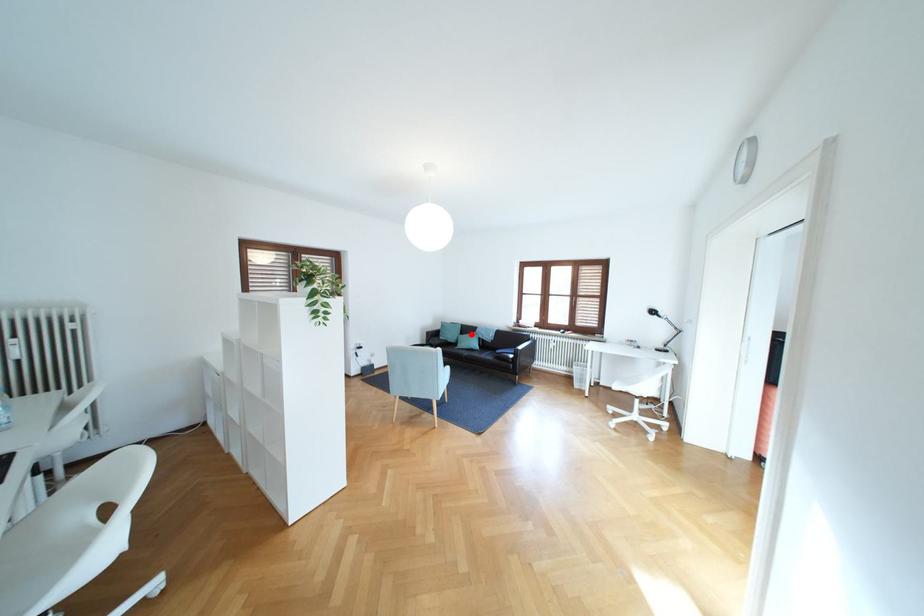
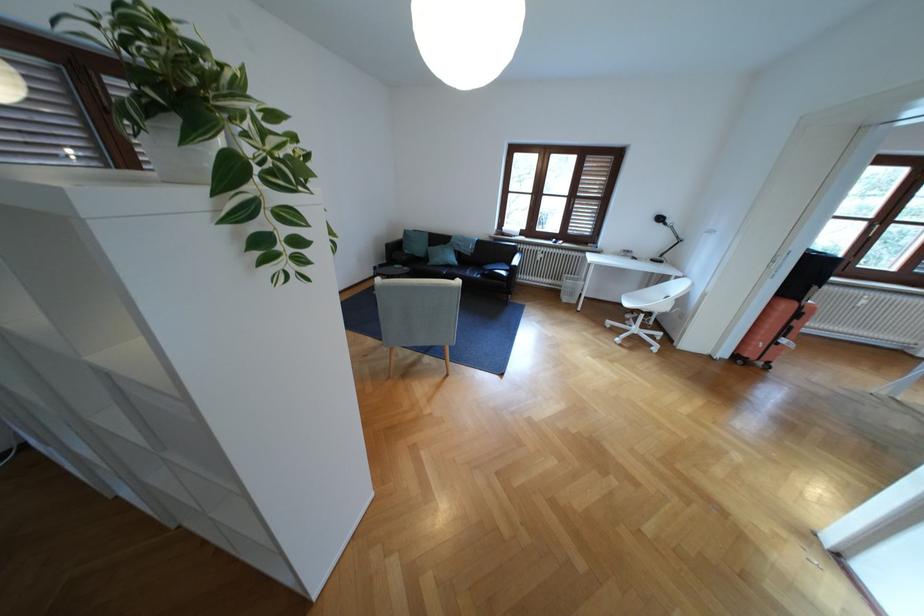
Question: I am providing you with two images of the same scene from different viewpoints. In image1, a red point is highlighted. Considering the same 3D point in image2, which of the following is correct?

Choices:
 (A) It is closer
 (B) It is farther

Answer: (A)